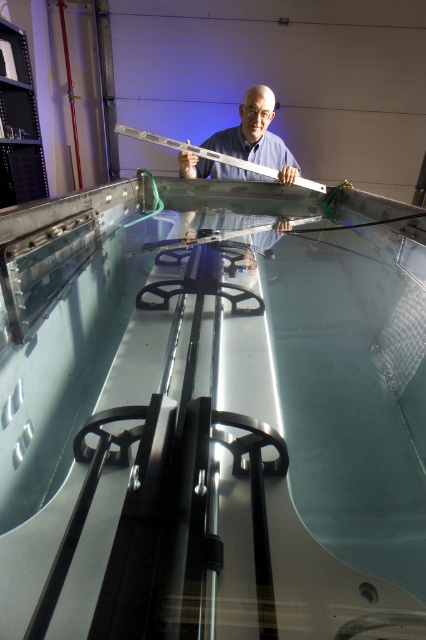
From the picture: You are an observer looking at the tank setup. You notice two rulers at the center of the image. Which ruler is closer to you, the matte white ruler at center or the metallic silver ruler at center?

The matte white ruler at center is closer to you because the metallic silver ruler at center is behind it.